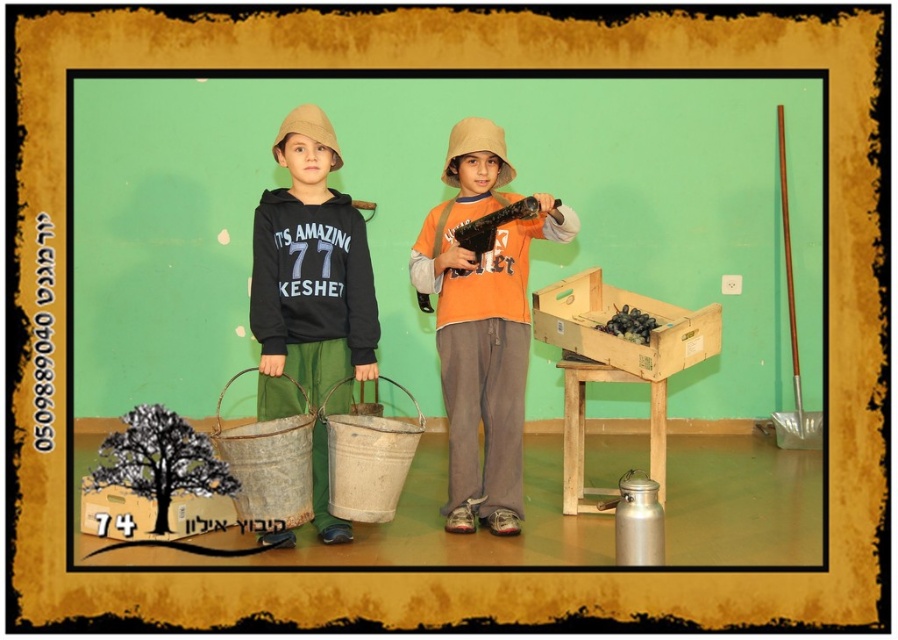
Question: Can you confirm if orange cotton shirt at center is positioned above matte black hoodie at center?

Choices:
 (A) no
 (B) yes

Answer: (A)

Question: Which of the following is the closest to the observer?

Choices:
 (A) (548, 289)
 (B) (292, 196)
 (C) (480, 364)

Answer: (B)

Question: Which point is closer to the camera taking this photo?

Choices:
 (A) (486, 371)
 (B) (349, 285)

Answer: (B)

Question: Is orange cotton shirt at center in front of matte black hoodie at center?

Choices:
 (A) yes
 (B) no

Answer: (A)

Question: Does orange cotton shirt at center appear on the left side of matte black hoodie at center?

Choices:
 (A) no
 (B) yes

Answer: (A)

Question: Among these objects, which one is farthest from the camera?

Choices:
 (A) orange cotton shirt at center
 (B) wooden crate at center

Answer: (B)